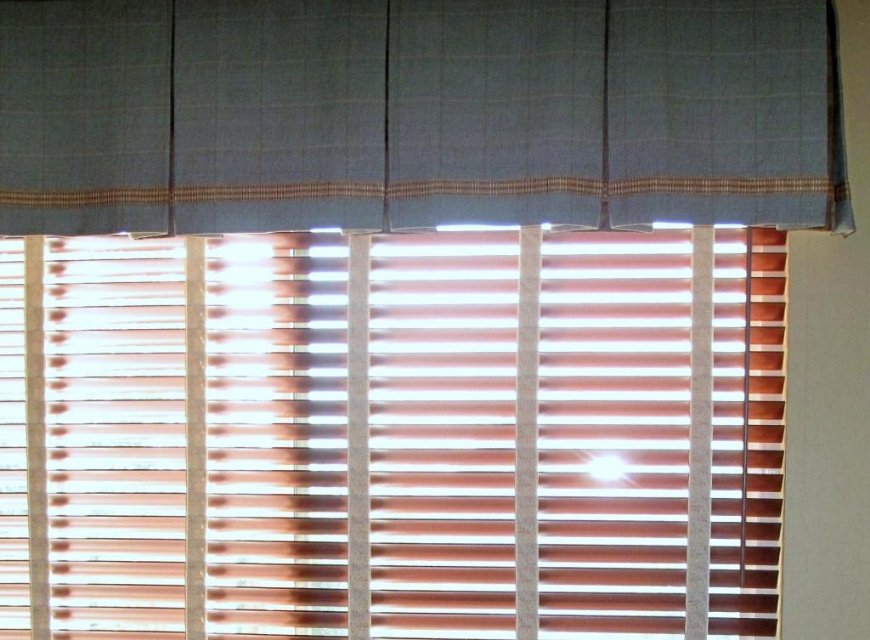
You are standing in a room with a window that has wooden blinds at center and a textured gray curtain at upper center. If you want to adjust the light coming through the window, which object should you move to the right to align with the curtain?

The wooden blinds at center should be moved to the right to align with the textured gray curtain at upper center since the wooden blinds at center is currently to the left of the textured gray curtain at upper center.

You are standing in front of a window with horizontal blinds. There is a specific point at coordinates point (392,435). What object is located at that point?

The wooden blinds at center are located at point (392,435).